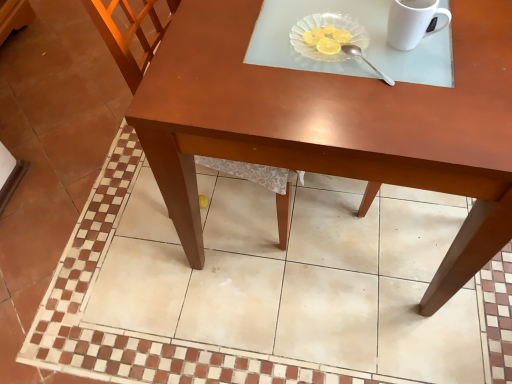
Locate an element on the screen. The height and width of the screenshot is (384, 512). free space above matte brown table at center (from a real-world perspective) is located at coordinates (198, 201).